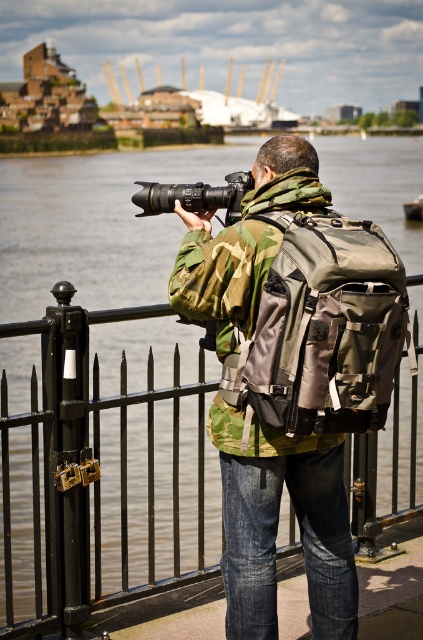
You are a photographer preparing to take a photo of a distant bird. You have a camouflage fabric backpack at center and a matte black camera at center. Which item should you pick up first if you need to adjust the camera settings before placing the backpack?

You should pick up the matte black camera at center first because the camouflage fabric backpack at center is smaller in size, so adjusting the camera settings must be done before handling the backpack.